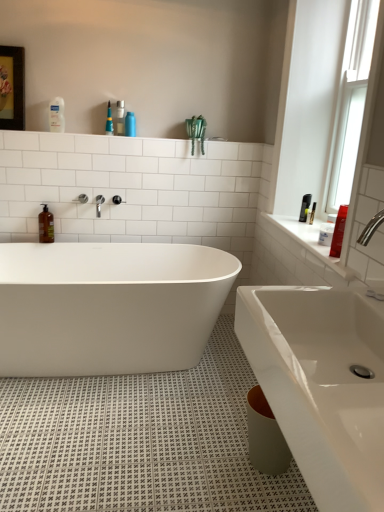
Based on the photo, in order to face clear glass window at upper right, should I rotate leftwards or rightwards?

Rotate right and turn 21.772 degrees.

In order to face wooden framed artwork at upper left, should I rotate leftwards or rightwards?

You should look left and rotate roughly 22.597 degrees.

Where is `matte black bottle at right, which is the first toiletry from right to left`? This screenshot has height=512, width=384. matte black bottle at right, which is the first toiletry from right to left is located at coordinates (338, 232).

At what (x,y) coordinates should I click in order to perform the action: click on white glossy lotion at upper left, the first toiletry from the left. Please return your answer as a coordinate pair (x, y). The width and height of the screenshot is (384, 512). Looking at the image, I should click on (56, 115).

From the image's perspective, is white glossy sink at lower right beneath wooden framed artwork at upper left?

Yes, from the image's perspective, white glossy sink at lower right is beneath wooden framed artwork at upper left.

The height and width of the screenshot is (512, 384). I want to click on medicine cabinet behind the white glossy sink at lower right, so click(12, 88).

Considering the positions of objects white glossy sink at lower right and matte black bottle at right, the second toiletry from the top, in the image provided, who is more to the left, white glossy sink at lower right or matte black bottle at right, the second toiletry from the top,?

white glossy sink at lower right.

Is white glossy sink at lower right far away from matte black bottle at right, the second toiletry from the top?

No.

Is white glossy sink at lower right in front of or behind matte black bottle at right, the 1th toiletry positioned from the front, in the image?

Clearly, white glossy sink at lower right is in front of matte black bottle at right, the 1th toiletry positioned from the front.

Are clear glass window at upper right and white glossy lotion at upper left, which ranks as the second toiletry in front-to-back order, making contact?

No, clear glass window at upper right is not making contact with white glossy lotion at upper left, which ranks as the second toiletry in front-to-back order.

The image size is (384, 512). I want to click on toiletry lying above the clear glass window at upper right (from the image's perspective), so click(56, 115).

Is point (346, 75) closer to camera compared to point (62, 98)?

Yes, it is in front of point (62, 98).

Which object is positioned more to the right, clear glass window at upper right or white glossy lotion at upper left, the first toiletry from the left?

clear glass window at upper right.

From a real-world perspective, is silver metallic faucet at upper center on top of white glossy bathtub at center?

Yes, from a real-world perspective, silver metallic faucet at upper center is above white glossy bathtub at center.

Can you confirm if silver metallic faucet at upper center is smaller than white glossy bathtub at center?

Yes, silver metallic faucet at upper center is smaller than white glossy bathtub at center.

Considering the relative positions of silver metallic faucet at upper center and white glossy bathtub at center in the image provided, is silver metallic faucet at upper center to the left of white glossy bathtub at center from the viewer's perspective?

Indeed, silver metallic faucet at upper center is positioned on the left side of white glossy bathtub at center.

Considering their positions, is silver metallic faucet at upper center located in front of or behind white glossy bathtub at center?

Visually, silver metallic faucet at upper center is located behind white glossy bathtub at center.

Does brown glass soap dispenser at left have a greater height compared to white glossy lotion at upper left, the 1th toiletry positioned from the top?

Indeed, brown glass soap dispenser at left has a greater height compared to white glossy lotion at upper left, the 1th toiletry positioned from the top.

Looking at this image, which is correct: brown glass soap dispenser at left is inside white glossy lotion at upper left, the first toiletry viewed from the back, or outside of it?

brown glass soap dispenser at left is not inside white glossy lotion at upper left, the first toiletry viewed from the back, it's outside.

Which is more to the right, brown glass soap dispenser at left or white glossy lotion at upper left, the first toiletry from the left?

white glossy lotion at upper left, the first toiletry from the left, is more to the right.

Is brown glass soap dispenser at left far from white glossy lotion at upper left, the first toiletry viewed from the back?

They are positioned close to each other.

Which object is positioned more to the left, white glossy bathtub at center or white glossy sink at lower right?

From the viewer's perspective, white glossy bathtub at center appears more on the left side.

Does point (61, 305) appear closer or farther from the camera than point (381, 498)?

Clearly, point (61, 305) is more distant from the camera than point (381, 498).

Where is `bathtub above the white glossy sink at lower right (from the image's perspective)`? Image resolution: width=384 pixels, height=512 pixels. bathtub above the white glossy sink at lower right (from the image's perspective) is located at coordinates (108, 306).

Could you tell me if brown glass soap dispenser at left is turned towards silver metallic faucet at upper center?

No, brown glass soap dispenser at left is not facing towards silver metallic faucet at upper center.

From the image's perspective, between brown glass soap dispenser at left and silver metallic faucet at upper center, who is located below?

brown glass soap dispenser at left appears lower in the image.

Who is taller, brown glass soap dispenser at left or silver metallic faucet at upper center?

Standing taller between the two is brown glass soap dispenser at left.

You are a GUI agent. You are given a task and a screenshot of the screen. Output one action in this format:
    pyautogui.click(x=<x>, y=<y>)
    Task: Click on the medicine cabinet to the left of white glossy sink at lower right
    The width and height of the screenshot is (384, 512).
    Given the screenshot: What is the action you would take?
    pyautogui.click(x=12, y=88)

Where is `sink below the matte black bottle at right, which is the first toiletry from right to left (from the image's perspective)`? sink below the matte black bottle at right, which is the first toiletry from right to left (from the image's perspective) is located at coordinates (321, 385).

When comparing their distances from silver metallic faucet at upper center, does clear glass window at upper right or matte black bottle at right, the 1th toiletry positioned from the front, seem further?

clear glass window at upper right is positioned further to the anchor silver metallic faucet at upper center.

From the image, which object appears to be nearer to wooden framed artwork at upper left, brown glass soap dispenser at left or white glossy sink at lower right?

Among the two, brown glass soap dispenser at left is located nearer to wooden framed artwork at upper left.

Which object lies nearer to the anchor point wooden framed artwork at upper left, white glossy lotion at upper left, which is the second toiletry from bottom to top, or clear glass window at upper right?

white glossy lotion at upper left, which is the second toiletry from bottom to top.

Which object lies nearer to the anchor point silver metallic faucet at upper center, matte black bottle at right, which is the second toiletry from left to right, or wooden framed artwork at upper left?

The object closer to silver metallic faucet at upper center is wooden framed artwork at upper left.

Considering their positions, is wooden framed artwork at upper left positioned closer to white glossy bathtub at center than white glossy lotion at upper left, the 1th toiletry positioned from the top?

Based on the image, white glossy lotion at upper left, the 1th toiletry positioned from the top, appears to be nearer to white glossy bathtub at center.

Based on their spatial positions, is white glossy sink at lower right or wooden framed artwork at upper left closer to matte black bottle at right, the second toiletry from the top?

white glossy sink at lower right is closer to matte black bottle at right, the second toiletry from the top.

Which object lies nearer to the anchor point white glossy lotion at upper left, which is the second toiletry from bottom to top, silver metallic faucet at upper center or clear glass window at upper right?

Based on the image, silver metallic faucet at upper center appears to be nearer to white glossy lotion at upper left, which is the second toiletry from bottom to top.

When comparing their distances from white glossy bathtub at center, does white glossy sink at lower right or brown glass soap dispenser at left seem further?

The object further to white glossy bathtub at center is white glossy sink at lower right.

I want to click on tap between wooden framed artwork at upper left and white glossy bathtub at center in the up-down direction, so click(x=99, y=204).

Identify the location of medicine cabinet located between white glossy sink at lower right and brown glass soap dispenser at left in the depth direction. The width and height of the screenshot is (384, 512). (12, 88).

Locate an element on the screen. The height and width of the screenshot is (512, 384). toiletry situated between brown glass soap dispenser at left and matte black bottle at right, positioned as the 1th toiletry in bottom-to-top order, from left to right is located at coordinates (56, 115).

Where is `bathtub between white glossy lotion at upper left, which ranks as the second toiletry in front-to-back order, and clear glass window at upper right`? The height and width of the screenshot is (512, 384). bathtub between white glossy lotion at upper left, which ranks as the second toiletry in front-to-back order, and clear glass window at upper right is located at coordinates (108, 306).